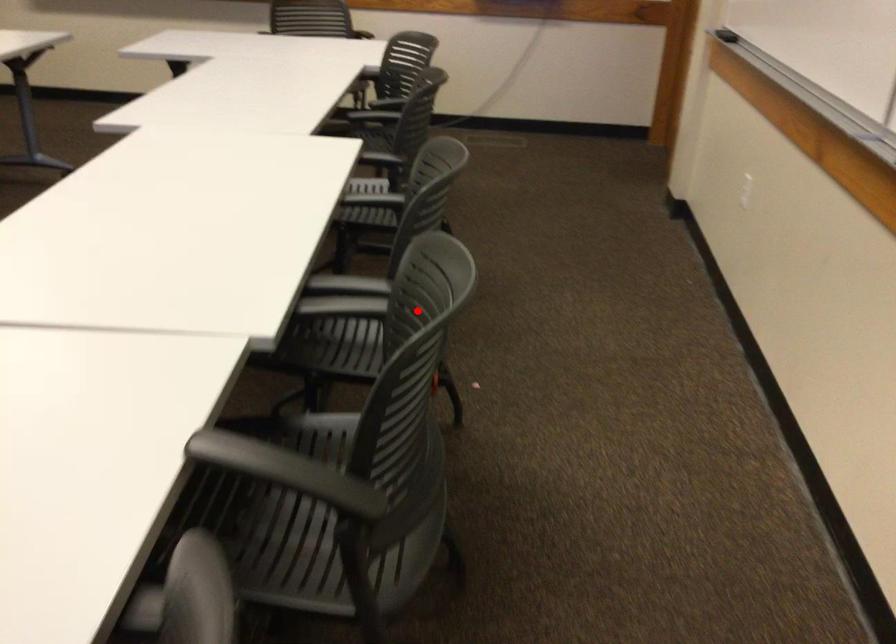
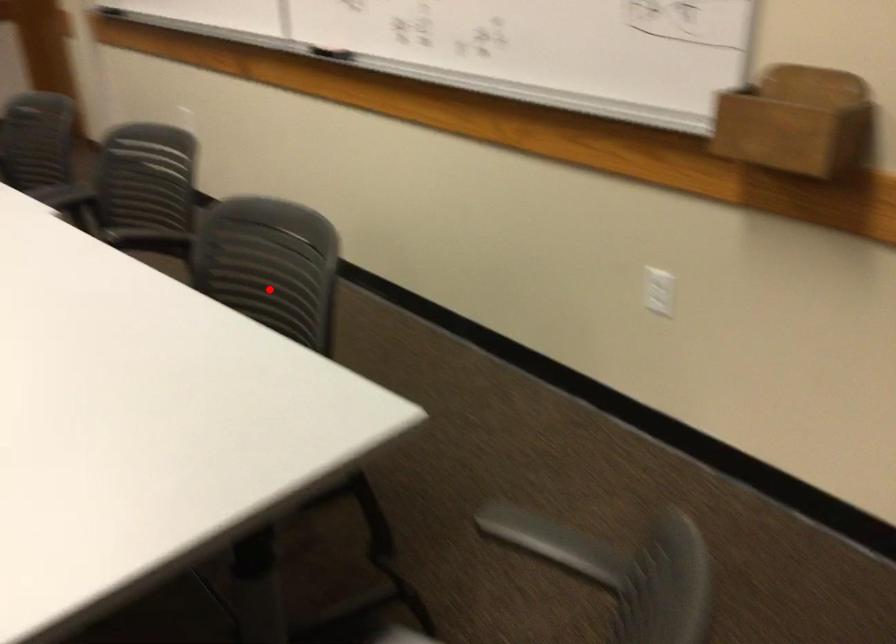
I am providing you with two images of the same scene from different viewpoints. A red point is marked on the first image and another point is marked on the second image. Is the red point in image1 aligned with the point shown in image2?

No